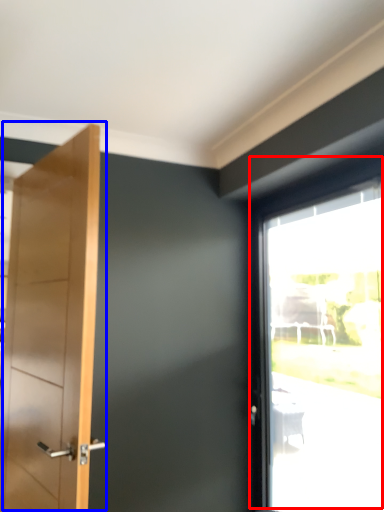
Question: Which of the following is the farthest to the observer, window (highlighted by a red box) or door (highlighted by a blue box)?

Choices:
 (A) window
 (B) door

Answer: (A)